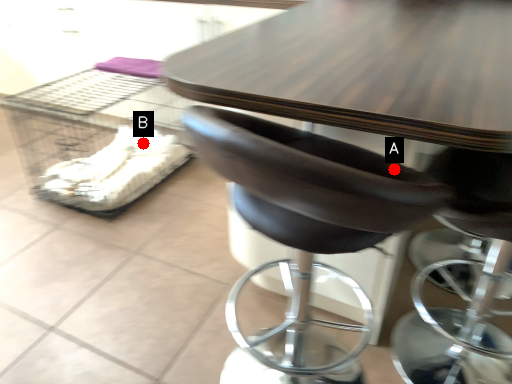
Question: Two points are circled on the image, labeled by A and B beside each circle. Which point is closer to the camera taking this photo?

Choices:
 (A) A is closer
 (B) B is closer

Answer: (A)